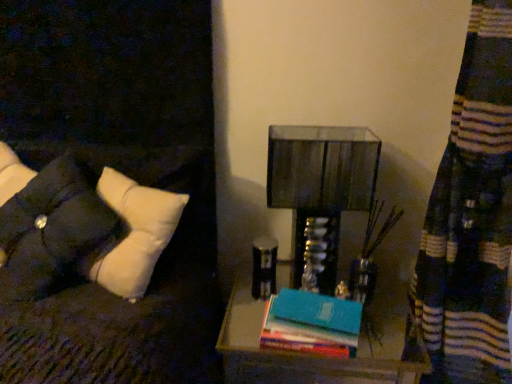
You are a GUI agent. You are given a task and a screenshot of the screen. Output one action in this format:
    pyautogui.click(x=<x>, y=<y>)
    Task: Click on the free space above teal matte book at center (from a real-world perspective)
    The height and width of the screenshot is (384, 512).
    Given the screenshot: What is the action you would take?
    pyautogui.click(x=315, y=304)